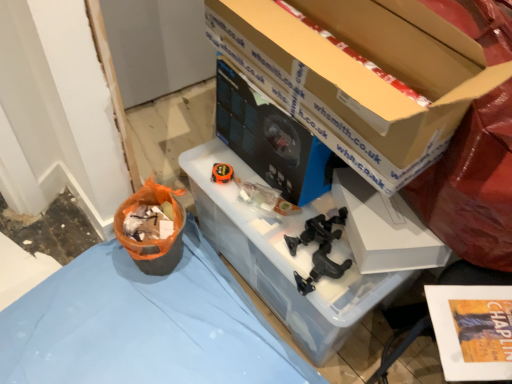
Question: Considering the positions of point (373, 228) and point (296, 241), is point (373, 228) closer or farther from the camera than point (296, 241)?

Choices:
 (A) farther
 (B) closer

Answer: (B)

Question: From their relative heights in the image, would you say white matte box at center, acting as the 1th box starting from the bottom, is taller or shorter than black plastic clamps at center, which ranks as the 2th toy in back-to-front order?

Choices:
 (A) short
 (B) tall

Answer: (B)

Question: Estimate the real-world distances between objects in this image. Which object is closer to the white matte box at center, which ranks as the 2th box in top-to-bottom order?

Choices:
 (A) blue fabric at center
 (B) black plastic clamps at center, the first toy from the front
 (C) orange rubber tape measure at center, which appears as the 2th toy when viewed from the front
 (D) matte black desktop computer at center
 (E) cardboard box at upper center, the first box from the top

Answer: (B)

Question: Which object is the farthest from the orange rubber tape measure at center, the second toy when ordered from right to left?

Choices:
 (A) cardboard box at upper center, which appears as the 2th box when ordered from the bottom
 (B) blue fabric at center
 (C) black plastic clamps at center, the 2th toy positioned from the left
 (D) white matte box at center, acting as the 1th box starting from the bottom
 (E) matte black desktop computer at center

Answer: (B)